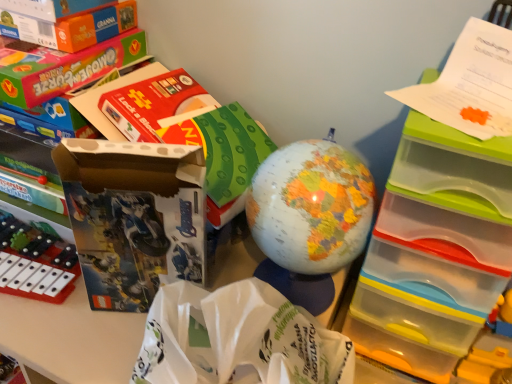
Question: Considering the relative sizes of matte cardboard box at left and yellow plastic toy at lower right, which is counted as the third toy, starting from the left, in the image provided, is matte cardboard box at left taller than yellow plastic toy at lower right, which is counted as the third toy, starting from the left,?

Choices:
 (A) no
 (B) yes

Answer: (B)

Question: Is matte cardboard box at left not near yellow plastic toy at lower right, the first toy from the right?

Choices:
 (A) no
 (B) yes

Answer: (A)

Question: Is matte cardboard box at left facing away from yellow plastic toy at lower right, which is counted as the third toy, starting from the left?

Choices:
 (A) no
 (B) yes

Answer: (A)

Question: Could you tell me if matte cardboard box at left is turned towards yellow plastic toy at lower right, which is counted as the third toy, starting from the left?

Choices:
 (A) yes
 (B) no

Answer: (B)

Question: Is matte cardboard box at left shorter than yellow plastic toy at lower right, which is counted as the third toy, starting from the left?

Choices:
 (A) no
 (B) yes

Answer: (A)

Question: In terms of height, does white paper bag at center look taller or shorter compared to orange cardboard box at upper left?

Choices:
 (A) tall
 (B) short

Answer: (A)

Question: Would you say white paper bag at center is inside or outside orange cardboard box at upper left?

Choices:
 (A) inside
 (B) outside

Answer: (B)

Question: Relative to orange cardboard box at upper left, is white paper bag at center in front or behind?

Choices:
 (A) front
 (B) behind

Answer: (A)

Question: From a real-world perspective, is white paper bag at center positioned above or below orange cardboard box at upper left?

Choices:
 (A) above
 (B) below

Answer: (B)

Question: Which is correct: orange cardboard box at upper left is inside yellow plastic toy at lower right, the first toy from the right, or outside of it?

Choices:
 (A) outside
 (B) inside

Answer: (A)

Question: From a real-world perspective, is orange cardboard box at upper left positioned above or below yellow plastic toy at lower right, which is counted as the third toy, starting from the left?

Choices:
 (A) below
 (B) above

Answer: (B)

Question: Is orange cardboard box at upper left bigger or smaller than yellow plastic toy at lower right, which is counted as the third toy, starting from the left?

Choices:
 (A) small
 (B) big

Answer: (B)

Question: Considering their positions, is orange cardboard box at upper left located in front of or behind yellow plastic toy at lower right, the first toy from the right?

Choices:
 (A) front
 (B) behind

Answer: (A)

Question: Considering the positions of clear plastic drawers at upper right and matte plastic globe at center, which is the 2th toy from left to right, in the image, is clear plastic drawers at upper right bigger or smaller than matte plastic globe at center, which is the 2th toy from left to right,?

Choices:
 (A) big
 (B) small

Answer: (A)

Question: Is clear plastic drawers at upper right to the left or to the right of matte plastic globe at center, the 2th toy in the right-to-left sequence, in the image?

Choices:
 (A) left
 (B) right

Answer: (B)